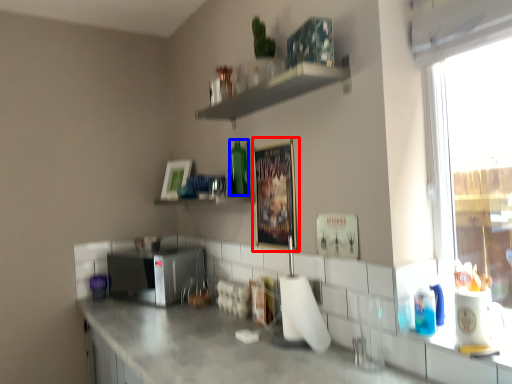
Question: Which point is closer to the camera, picture frame (highlighted by a red box) or bottle (highlighted by a blue box)?

Choices:
 (A) picture frame
 (B) bottle

Answer: (A)